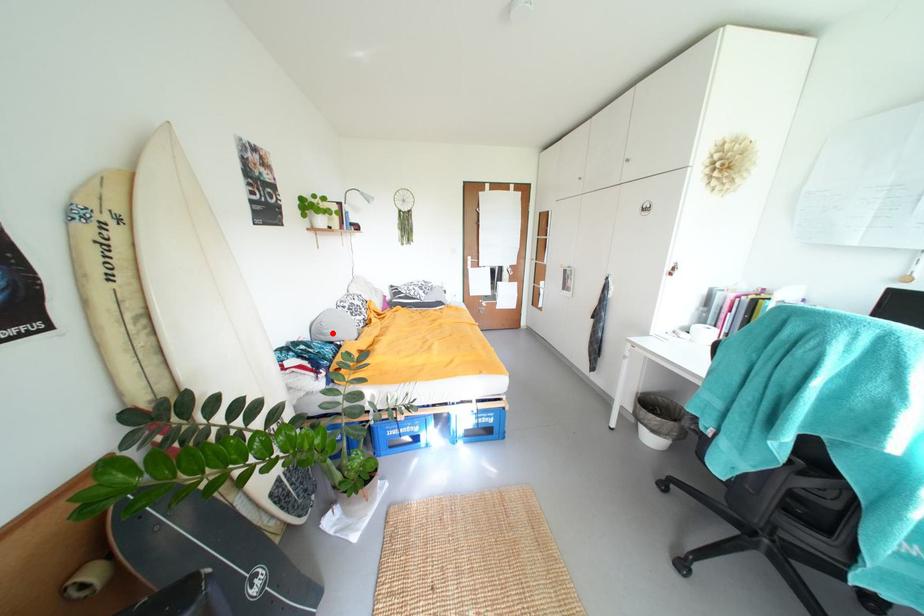
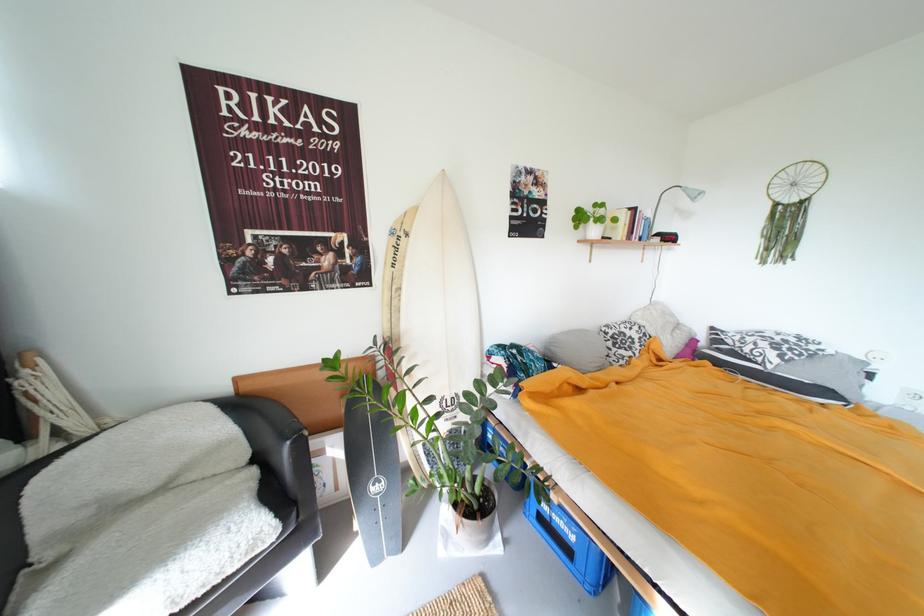
Locate, in the second image, the point that corresponds to the highlighted location in the first image.

(560, 350)